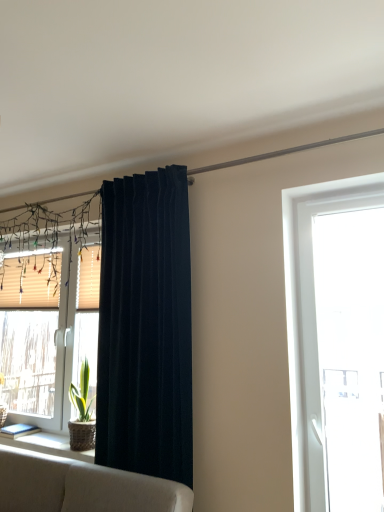
Question: In the image, is beige textured shutter at left, acting as the first shutter starting from the right, positioned in front of or behind beige wood shutter at left, acting as the second shutter starting from the right?

Choices:
 (A) front
 (B) behind

Answer: (A)

Question: In terms of width, does beige textured shutter at left, the first shutter positioned from the front, look wider or thinner when compared to beige wood shutter at left, the 1th shutter when ordered from left to right?

Choices:
 (A) thin
 (B) wide

Answer: (A)

Question: Which of these objects is positioned closest to the beige textured blinds at left, which appears as the second window when viewed from the right?

Choices:
 (A) beige wood shutter at left, which ranks as the 1th shutter in back-to-front order
 (B) beige textured shutter at left, marked as the 2th shutter in a back-to-front arrangement
 (C) natural wood window sill at lower left
 (D) transparent glass door at right, which appears as the second window when viewed from the back
 (E) dark blue velvet curtain at center

Answer: (A)

Question: Which of these objects is positioned closest to the natural wood window sill at lower left?

Choices:
 (A) beige textured blinds at left, which appears as the second window when viewed from the right
 (B) beige wood shutter at left, the 2th shutter in the front-to-back sequence
 (C) dark blue velvet curtain at center
 (D) beige textured shutter at left, the first shutter positioned from the front
 (E) transparent glass door at right, which is the 1th window from front to back

Answer: (C)